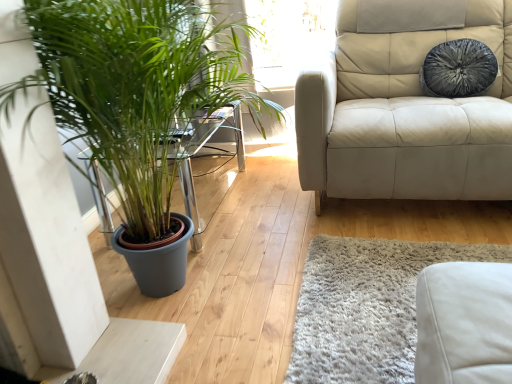
What do you see at coordinates (133, 90) in the screenshot? I see `green matte plant at left` at bounding box center [133, 90].

In the scene shown: Measure the distance between green matte plant at left and camera.

green matte plant at left is 37.08 inches away from camera.

The image size is (512, 384). I want to click on green matte plant at left, so click(x=133, y=90).

This screenshot has width=512, height=384. What do you see at coordinates (458, 69) in the screenshot? I see `velvety gray pillow at upper right` at bounding box center [458, 69].

Locate an element on the screen. Image resolution: width=512 pixels, height=384 pixels. velvety gray pillow at upper right is located at coordinates (458, 69).

The height and width of the screenshot is (384, 512). Find the location of `green matte plant at left`. green matte plant at left is located at coordinates (133, 90).

Does velvety gray pillow at upper right appear on the right side of green matte plant at left?

Indeed, velvety gray pillow at upper right is positioned on the right side of green matte plant at left.

Is the position of velvety gray pillow at upper right less distant than that of green matte plant at left?

No, velvety gray pillow at upper right is further to the viewer.

Between point (469, 52) and point (128, 35), which one is positioned behind?

Positioned behind is point (469, 52).

From the image's perspective, would you say velvety gray pillow at upper right is positioned over green matte plant at left?

Yes.

From a real-world perspective, which object rests below the other?

In real-world perspective, green matte plant at left is lower.

Between velvety gray pillow at upper right and green matte plant at left, which one has smaller width?

velvety gray pillow at upper right is thinner.

From their relative heights in the image, would you say velvety gray pillow at upper right is taller or shorter than green matte plant at left?

In the image, velvety gray pillow at upper right appears to be shorter than green matte plant at left.

Is velvety gray pillow at upper right bigger than green matte plant at left?

Actually, velvety gray pillow at upper right might be smaller than green matte plant at left.

Is velvety gray pillow at upper right situated inside green matte plant at left or outside?

velvety gray pillow at upper right is not enclosed by green matte plant at left.

Is the surface of velvety gray pillow at upper right in direct contact with green matte plant at left?

No.

Is green matte plant at left at the back of velvety gray pillow at upper right?

That's not correct — velvety gray pillow at upper right is not looking away from green matte plant at left.

At what (x,y) coordinates should I click in order to perform the action: click on houseplant below the velvety gray pillow at upper right (from a real-world perspective). Please return your answer as a coordinate pair (x, y). Looking at the image, I should click on (133, 90).

Considering the relative positions of green matte plant at left and velvety gray pillow at upper right in the image provided, is green matte plant at left to the left or to the right of velvety gray pillow at upper right?

From the image, it's evident that green matte plant at left is to the left of velvety gray pillow at upper right.

Does green matte plant at left lie behind velvety gray pillow at upper right?

No, green matte plant at left is in front of velvety gray pillow at upper right.

Which is nearer, (152, 122) or (450, 97)?

Point (152, 122).

From the image's perspective, between green matte plant at left and velvety gray pillow at upper right, which one is located above?

velvety gray pillow at upper right.

From a real-world perspective, is green matte plant at left positioned under velvety gray pillow at upper right based on gravity?

Yes.

Between green matte plant at left and velvety gray pillow at upper right, which one has smaller width?

Thinner between the two is velvety gray pillow at upper right.

Considering the sizes of green matte plant at left and velvety gray pillow at upper right in the image, is green matte plant at left taller or shorter than velvety gray pillow at upper right?

Clearly, green matte plant at left is taller compared to velvety gray pillow at upper right.

Which of these two, green matte plant at left or velvety gray pillow at upper right, is smaller?

With smaller size is velvety gray pillow at upper right.

Is velvety gray pillow at upper right located within green matte plant at left?

No.

Would you consider green matte plant at left to be distant from velvety gray pillow at upper right?

Absolutely, green matte plant at left is distant from velvety gray pillow at upper right.

Could you tell me if green matte plant at left is turned towards velvety gray pillow at upper right?

Yes, green matte plant at left is turned towards velvety gray pillow at upper right.

What's the angular difference between green matte plant at left and velvety gray pillow at upper right's facing directions?

There is a 96.1-degree angle between the facing directions of green matte plant at left and velvety gray pillow at upper right.

How much distance is there between green matte plant at left and velvety gray pillow at upper right?

green matte plant at left and velvety gray pillow at upper right are 1.28 meters apart from each other.

Where is `houseplant in front of the velvety gray pillow at upper right`? houseplant in front of the velvety gray pillow at upper right is located at coordinates (133, 90).

Identify the location of houseplant to the left of velvety gray pillow at upper right. (133, 90).

Locate an element on the screen. Image resolution: width=512 pixels, height=384 pixels. houseplant in front of the velvety gray pillow at upper right is located at coordinates click(x=133, y=90).